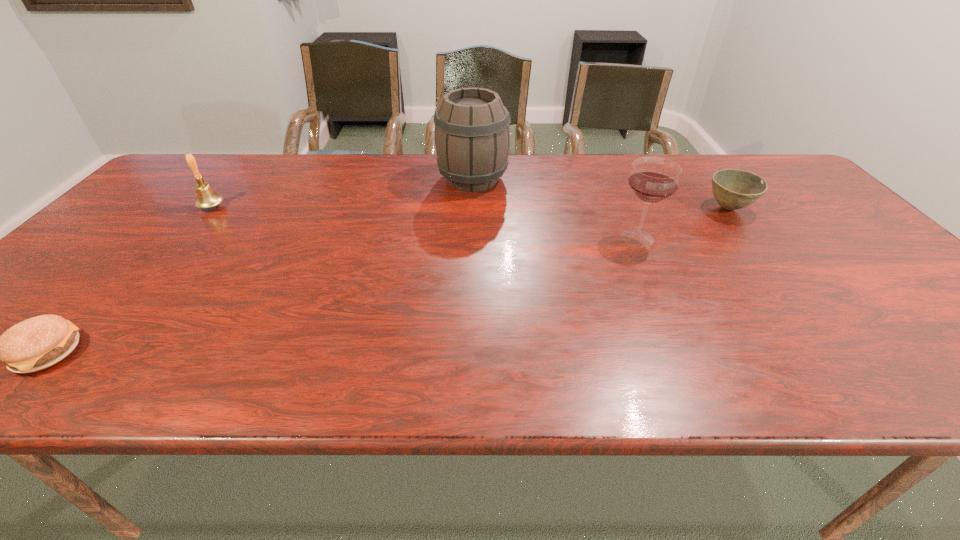
I want to click on the tallest object, so click(472, 135).

Identify the location of the third object from right to left. The height and width of the screenshot is (540, 960). (472, 135).

Where is `the fourth object from left to right`? The width and height of the screenshot is (960, 540). the fourth object from left to right is located at coordinates (653, 179).

The width and height of the screenshot is (960, 540). Identify the location of the fourth shortest object. click(x=653, y=179).

Image resolution: width=960 pixels, height=540 pixels. What are the coordinates of `the third tallest object` in the screenshot? It's located at (206, 197).

Where is `bowl`? bowl is located at coordinates (733, 189).

Find the location of `the rightmost object`. the rightmost object is located at coordinates (733, 189).

At what (x,y) coordinates should I click in order to perform the action: click on vacant space located on the left of the tallest object. Please return your answer as a coordinate pair (x, y). This screenshot has height=540, width=960. Looking at the image, I should click on (386, 180).

Find the location of `vacant region located 0.320m on the front of the wineglass`. vacant region located 0.320m on the front of the wineglass is located at coordinates (x=689, y=352).

Locate an element on the screen. vacant area located 0.200m on the right of the bell is located at coordinates (295, 207).